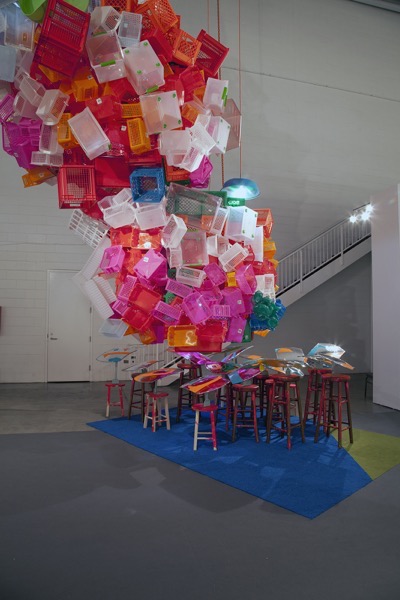
Locate an element on the screen. door is located at coordinates (65, 323).